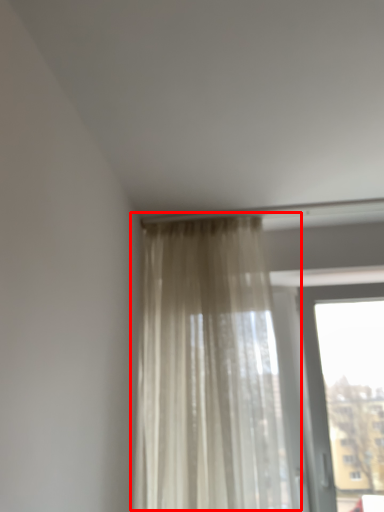
Question: Where is curtain (annotated by the red box) located in relation to window in the image?

Choices:
 (A) left
 (B) right

Answer: (A)